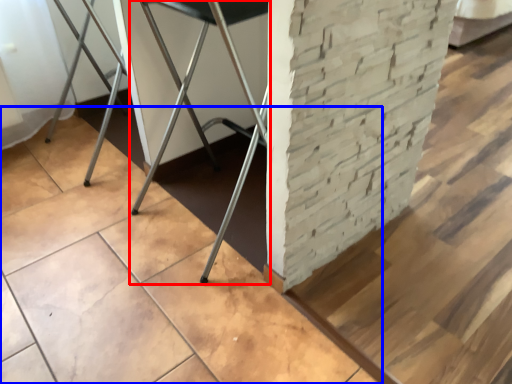
Question: Which point is closer to the camera, furniture (highlighted by a red box) or concrete (highlighted by a blue box)?

Choices:
 (A) furniture
 (B) concrete

Answer: (B)